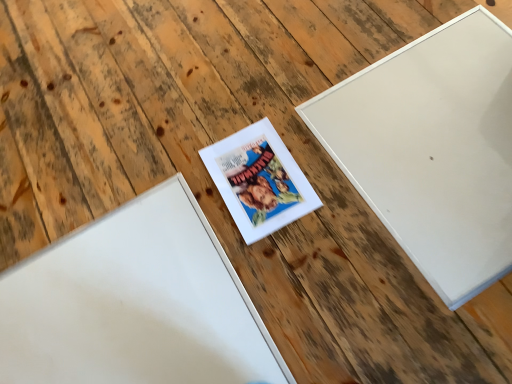
In order to click on vacant space underneath white matte picture frame at upper right, arranged as the first picture frame when viewed from the right (from a real-world perspective) in this screenshot , I will do `click(435, 132)`.